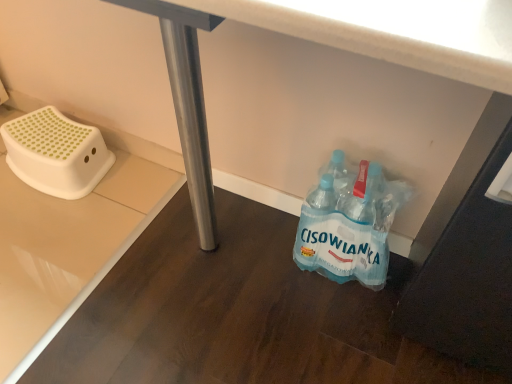
The width and height of the screenshot is (512, 384). I want to click on free space in front of translucent plastic bottles at lower right, so click(333, 328).